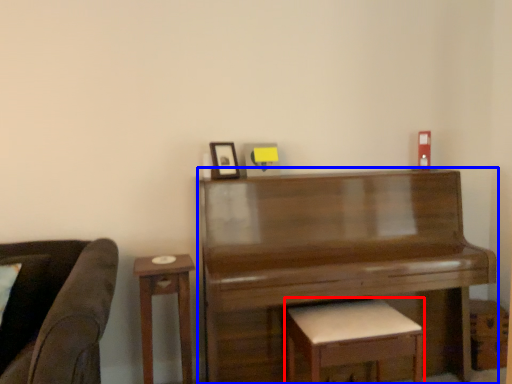
Question: Which object is further to the camera taking this photo, stool (highlighted by a red box) or piano (highlighted by a blue box)?

Choices:
 (A) stool
 (B) piano

Answer: (B)